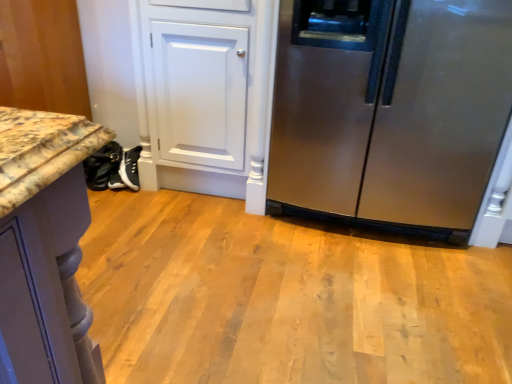
At what (x,y) coordinates should I click in order to perform the action: click on free space in front of black leather shoes at lower left. Please return your answer as a coordinate pair (x, y). This screenshot has height=384, width=512. Looking at the image, I should click on (109, 198).